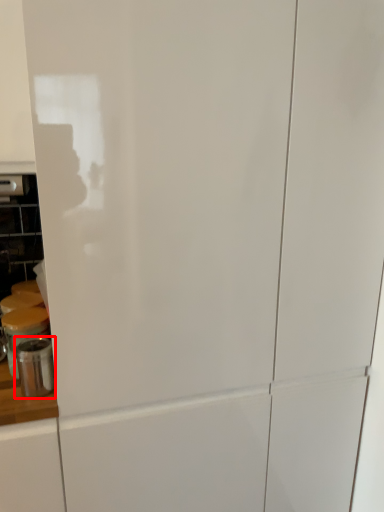
Question: From the image's perspective, where is appliance (annotated by the red box) located in relation to appliance in the image?

Choices:
 (A) below
 (B) above

Answer: (A)